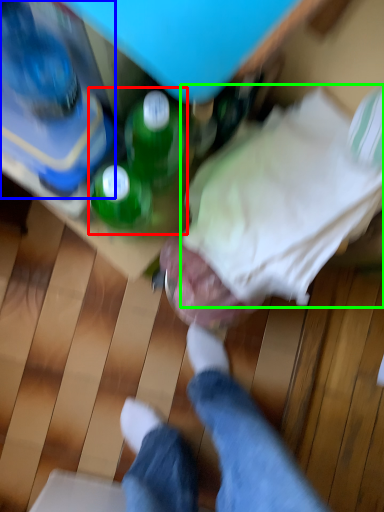
Question: Which object is the closest to the beverage (highlighted by a red box)? Choose among these: bottle (highlighted by a blue box) or clothing (highlighted by a green box).

Choices:
 (A) bottle
 (B) clothing

Answer: (A)